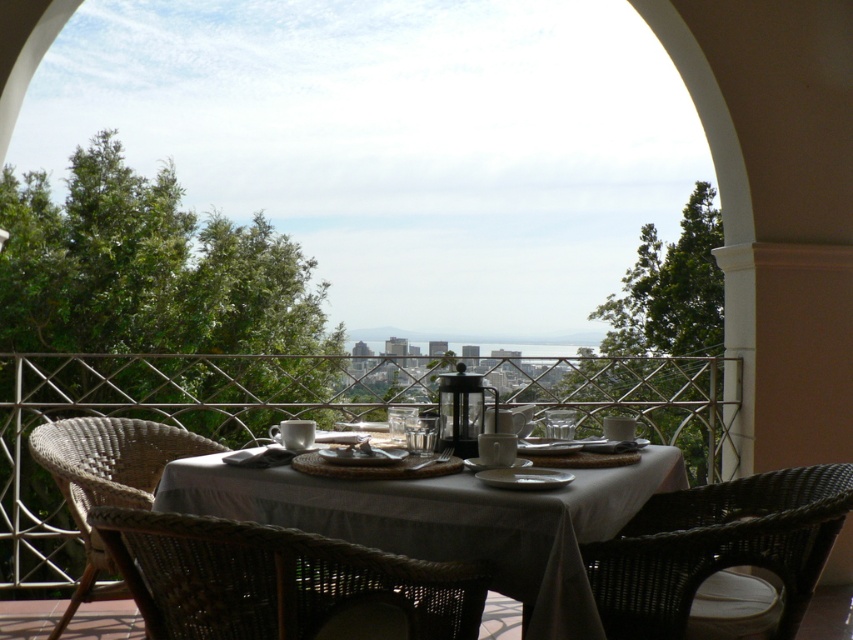
Question: Which object appears farthest from the camera in this image?

Choices:
 (A) white woven table at center
 (B) woven dark brown chair at lower right
 (C) white ceramic plate at center

Answer: (C)

Question: Where is woven dark brown chair at lower right located in relation to white ceramic plate at center in the image?

Choices:
 (A) left
 (B) right

Answer: (B)

Question: Which of these objects is positioned closest to the white ceramic plate at center?

Choices:
 (A) woven dark brown chair at lower right
 (B) woven rattan chair at lower center
 (C) white woven table at center
 (D) woven rattan chair at lower left

Answer: (C)

Question: Does woven rattan chair at lower center have a greater width compared to white ceramic plate at center?

Choices:
 (A) yes
 (B) no

Answer: (B)

Question: Observing the image, what is the correct spatial positioning of woven dark brown chair at lower right in reference to white ceramic plate at center?

Choices:
 (A) left
 (B) right

Answer: (B)

Question: Which point appears farthest from the camera in this image?

Choices:
 (A) (376, 465)
 (B) (494, 500)
 (C) (218, 563)
 (D) (204, 436)

Answer: (D)